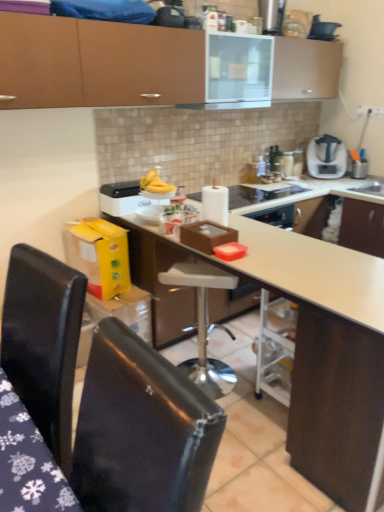
Question: Is black plastic kettle at upper center bigger than black leather chair at lower left, which appears as the 2th chair when viewed from the right?

Choices:
 (A) yes
 (B) no

Answer: (B)

Question: Considering the relative positions of black plastic kettle at upper center and black leather chair at lower left, which appears as the 2th chair when viewed from the right, in the image provided, is black plastic kettle at upper center to the left of black leather chair at lower left, which appears as the 2th chair when viewed from the right, from the viewer's perspective?

Choices:
 (A) yes
 (B) no

Answer: (B)

Question: Is black plastic kettle at upper center placed right next to black leather chair at lower left, which appears as the 2th chair when viewed from the right?

Choices:
 (A) yes
 (B) no

Answer: (B)

Question: From a real-world perspective, is black plastic kettle at upper center on top of black leather chair at lower left, which appears as the 2th chair when viewed from the right?

Choices:
 (A) yes
 (B) no

Answer: (A)

Question: Considering the relative sizes of black plastic kettle at upper center and black leather chair at lower left, placed as the 1th chair when sorted from left to right, in the image provided, is black plastic kettle at upper center smaller than black leather chair at lower left, placed as the 1th chair when sorted from left to right,?

Choices:
 (A) yes
 (B) no

Answer: (A)

Question: In terms of width, does black plastic kettle at upper center look wider or thinner when compared to glossy black chair at lower left, which is the 2th chair in left-to-right order?

Choices:
 (A) wide
 (B) thin

Answer: (B)

Question: From the image's perspective, relative to glossy black chair at lower left, which is the 2th chair in left-to-right order, is black plastic kettle at upper center above or below?

Choices:
 (A) above
 (B) below

Answer: (A)

Question: Considering the positions of black plastic kettle at upper center and glossy black chair at lower left, the 1th chair in the right-to-left sequence, in the image, is black plastic kettle at upper center taller or shorter than glossy black chair at lower left, the 1th chair in the right-to-left sequence,?

Choices:
 (A) tall
 (B) short

Answer: (B)

Question: Do you think black plastic kettle at upper center is within glossy black chair at lower left, which is the 2th chair in left-to-right order, or outside of it?

Choices:
 (A) inside
 (B) outside

Answer: (B)

Question: In terms of size, does matte brown cabinet at upper center appear bigger or smaller than white glossy exhaust hood at upper center?

Choices:
 (A) small
 (B) big

Answer: (B)

Question: From a real-world perspective, is matte brown cabinet at upper center positioned above or below white glossy exhaust hood at upper center?

Choices:
 (A) above
 (B) below

Answer: (A)

Question: Is matte brown cabinet at upper center taller or shorter than white glossy exhaust hood at upper center?

Choices:
 (A) short
 (B) tall

Answer: (B)

Question: From the image's perspective, is matte brown cabinet at upper center above or below white glossy exhaust hood at upper center?

Choices:
 (A) above
 (B) below

Answer: (A)

Question: Is black plastic kettle at upper center taller or shorter than satin silver blender at upper right?

Choices:
 (A) tall
 (B) short

Answer: (B)

Question: Considering the positions of point (332, 35) and point (309, 172), is point (332, 35) closer or farther from the camera than point (309, 172)?

Choices:
 (A) farther
 (B) closer

Answer: (B)